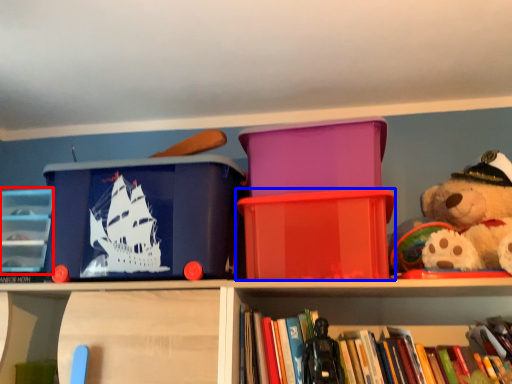
Question: Which of the following is the closest to the observer, shelf (highlighted by a red box) or storage box (highlighted by a blue box)?

Choices:
 (A) shelf
 (B) storage box

Answer: (B)